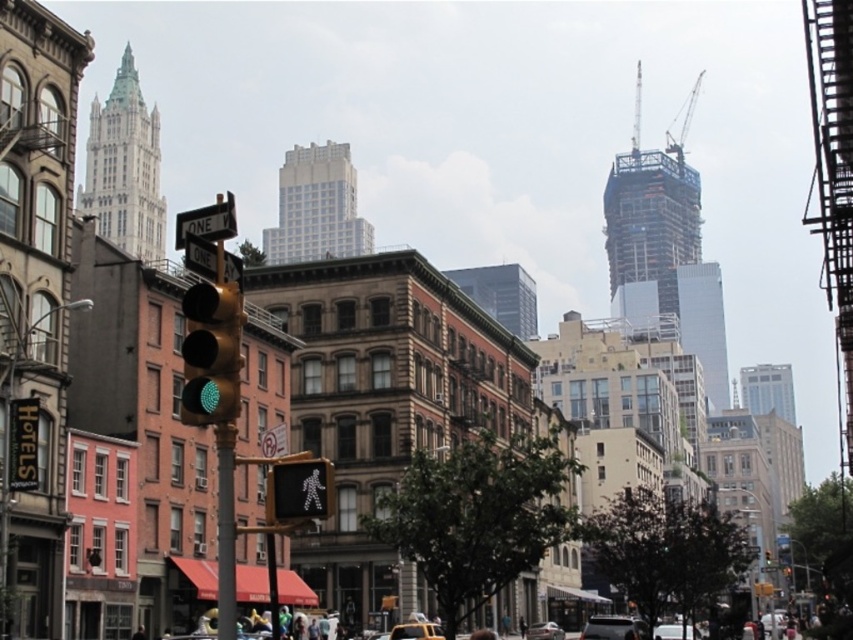
You are a driver in a metallic silver car at center. You see a metallic pole at center ahead. According to the traffic light, can you turn left here?

Answer: The metallic pole at center is to the left of the metallic silver car at center, but the traffic light shows green and has a one way sign pointing to the right. Therefore, you cannot turn left here as the one way sign indicates you must go in the direction it points.

You are a pedestrian standing at the crosswalk. You see the metallic pole at center and the metallic silver car at center. Which object is closer to you?

The metallic pole at center is closer to you because it is in front of the metallic silver car at center.

You are a pedestrian waiting at the crosswalk. You see the translucent plastic pedestrian signal at center and the metallic pole at center. Which object is closer to the right side of your view?

The translucent plastic pedestrian signal at center is to the right of the metallic pole at center, so it is closer to the right side of your view.